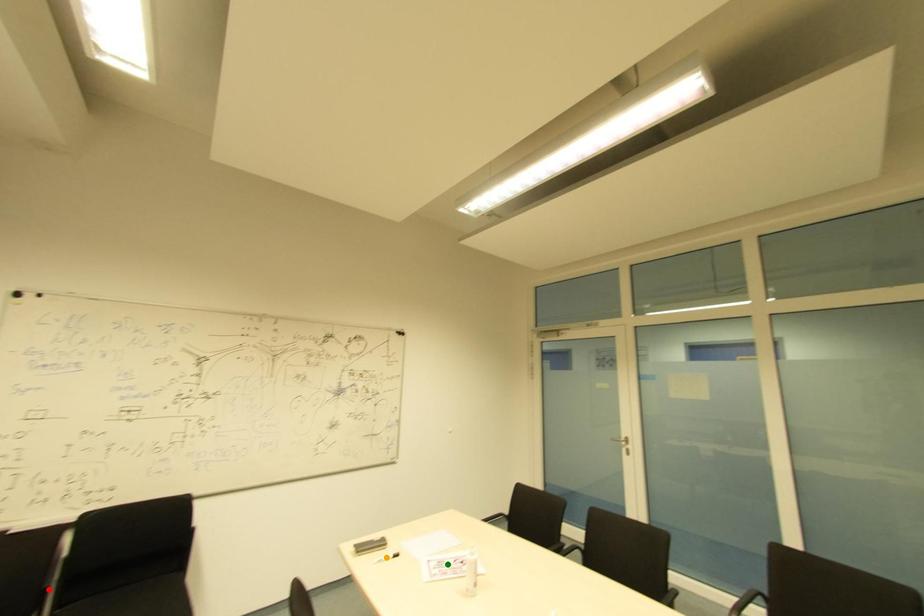
Order these from nearest to farthest:
green point
red point
orange point

red point, green point, orange point